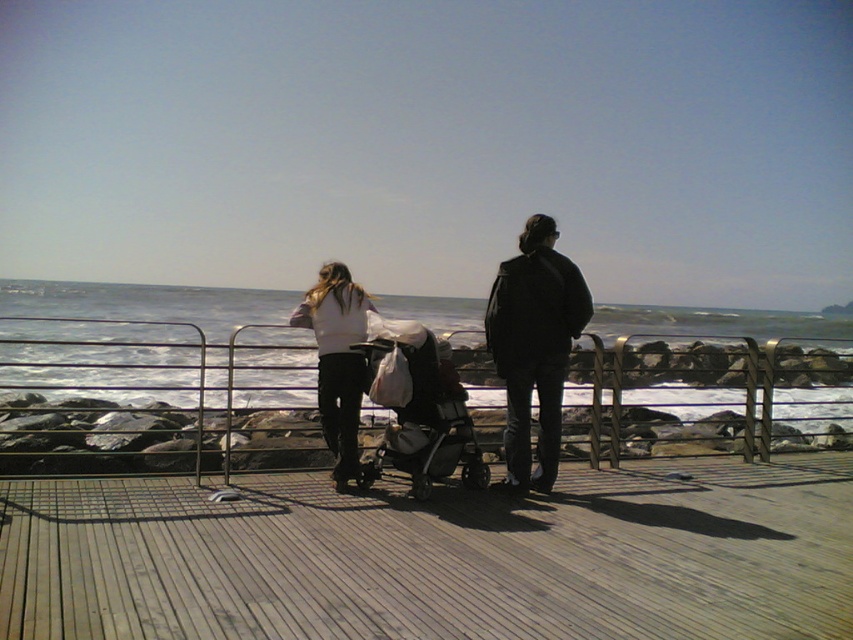
Between wooden at center and blue water at center, which one appears on the left side from the viewer's perspective?

blue water at center is more to the left.

Can you confirm if wooden at center is positioned to the left of blue water at center?

No, wooden at center is not to the left of blue water at center.

Does point (86, 481) come in front of point (233, 300)?

Yes.

You are a GUI agent. You are given a task and a screenshot of the screen. Output one action in this format:
    pyautogui.click(x=<x>, y=<y>)
    Task: Click on the wooden at center
    
    Given the screenshot: What is the action you would take?
    pos(438,557)

Does black leather jacket at center have a larger size compared to white matte shirt at center?

Indeed, black leather jacket at center has a larger size compared to white matte shirt at center.

Which is below, black leather jacket at center or white matte shirt at center?

white matte shirt at center is below.

Is point (527, 385) in front of point (357, 340)?

That is False.

Find the location of a particular element. black leather jacket at center is located at coordinates (534, 346).

Can you confirm if blue water at center is positioned above white matte shirt at center?

Correct, blue water at center is located above white matte shirt at center.

Which is in front, point (592, 321) or point (341, 397)?

Point (341, 397) is in front.

The width and height of the screenshot is (853, 640). I want to click on blue water at center, so click(146, 304).

The image size is (853, 640). I want to click on blue water at center, so click(x=146, y=304).